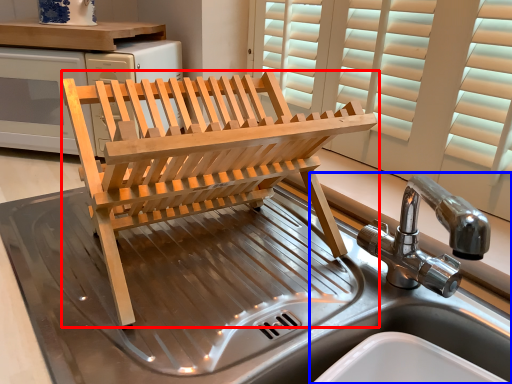
Question: Which object is further to the camera taking this photo, furniture (highlighted by a red box) or sink (highlighted by a blue box)?

Choices:
 (A) furniture
 (B) sink

Answer: (A)